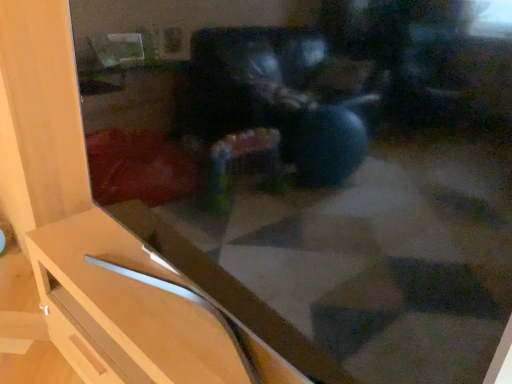
Describe the element at coordinates (127, 310) in the screenshot. I see `matte wood shelf at center` at that location.

Measure the distance between point (161, 277) and camera.

The depth of point (161, 277) is 4.02 feet.

Where is `matte wood shelf at center`? The image size is (512, 384). matte wood shelf at center is located at coordinates (127, 310).

This screenshot has width=512, height=384. Identify the location of matte wood shelf at center. (127, 310).